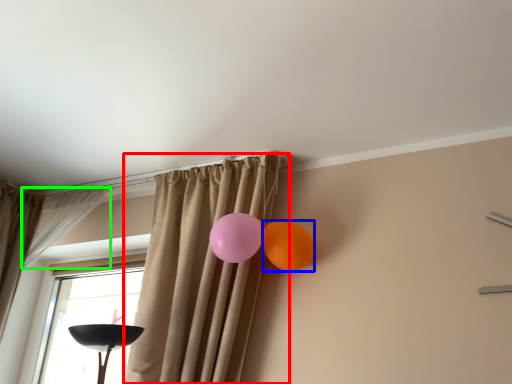
Question: Considering the real-world distances, which object is closest to curtain (highlighted by a red box)? balloon (highlighted by a blue box) or curtain (highlighted by a green box).

Choices:
 (A) balloon
 (B) curtain

Answer: (A)